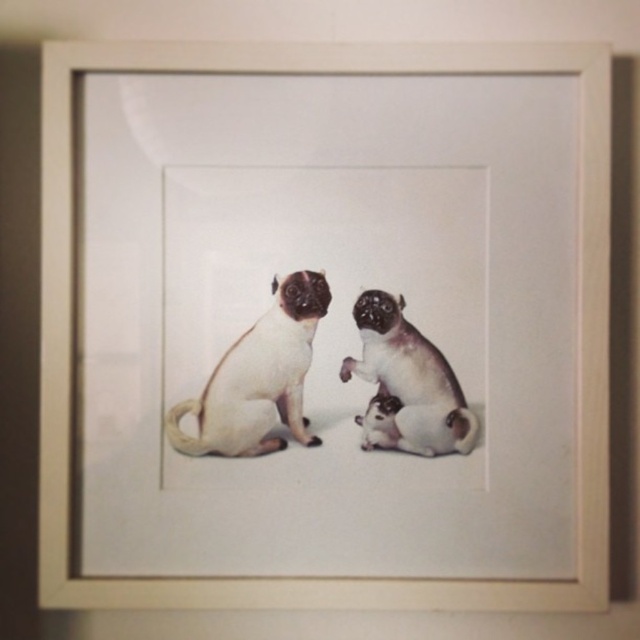
You are an art appraiser examining the framed artwork. You need to determine if the smooth beige pug at center and the smooth white dog at lower right are of equal size. Based on the artwork, what can you conclude?

The smooth beige pug at center is larger in size than the smooth white dog at lower right, so they are not of equal size.

You are an art appraiser examining the framed artwork. You need to determine the spatial relationship between the smooth beige pug at center and the smooth white dog at lower right. Which one is positioned lower in the image?

The smooth beige pug at center is located below smooth white dog at lower right, so the smooth beige pug at center is positioned lower in the image.

You are an art restorer examining the framed artwork. You notice two points of concern marked at coordinates point (257, 445) and point (376, 308). Which point is closer to the viewer?

Point (257, 445) is closer to the viewer than point (376, 308).